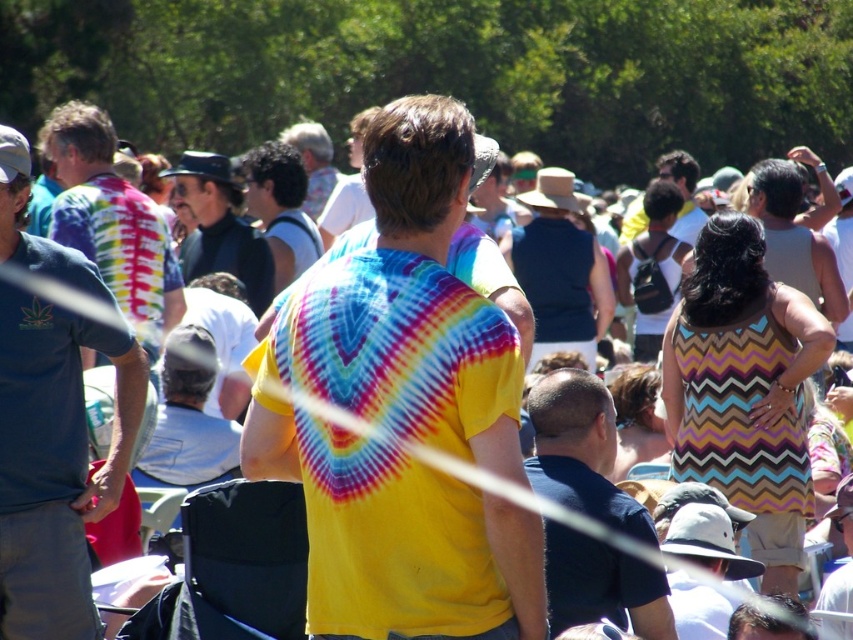
Can you confirm if tie-dye fabric shirt at center is bigger than tie-dye fabric shirt at left?

Yes.

Between point (376, 612) and point (126, 282), which one is positioned behind?

Positioned behind is point (126, 282).

Identify the location of tie-dye fabric shirt at center. (410, 305).

Where is `matte tie-dye shirt at left`? matte tie-dye shirt at left is located at coordinates (55, 460).

Where is `matte tie-dye shirt at left`? matte tie-dye shirt at left is located at coordinates (55, 460).

Does tie-dye fabric shirt at center have a greater height compared to striped tank top at center?

Yes.

Measure the distance between point (343, 554) and camera.

The distance of point (343, 554) from camera is 9.28 meters.

Where is `tie-dye fabric shirt at center`? tie-dye fabric shirt at center is located at coordinates (410, 305).

You are a GUI agent. You are given a task and a screenshot of the screen. Output one action in this format:
    pyautogui.click(x=<x>, y=<y>)
    Task: Click on the tie-dye fabric shirt at center
    Image resolution: width=853 pixels, height=640 pixels.
    Given the screenshot: What is the action you would take?
    pyautogui.click(x=410, y=305)